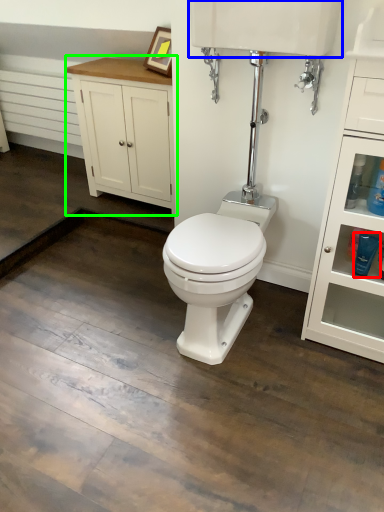
Question: Which object is positioned farthest from toiletry (highlighted by a red box)? Select from sink (highlighted by a blue box) and bathroom cabinet (highlighted by a green box).

Choices:
 (A) sink
 (B) bathroom cabinet

Answer: (B)